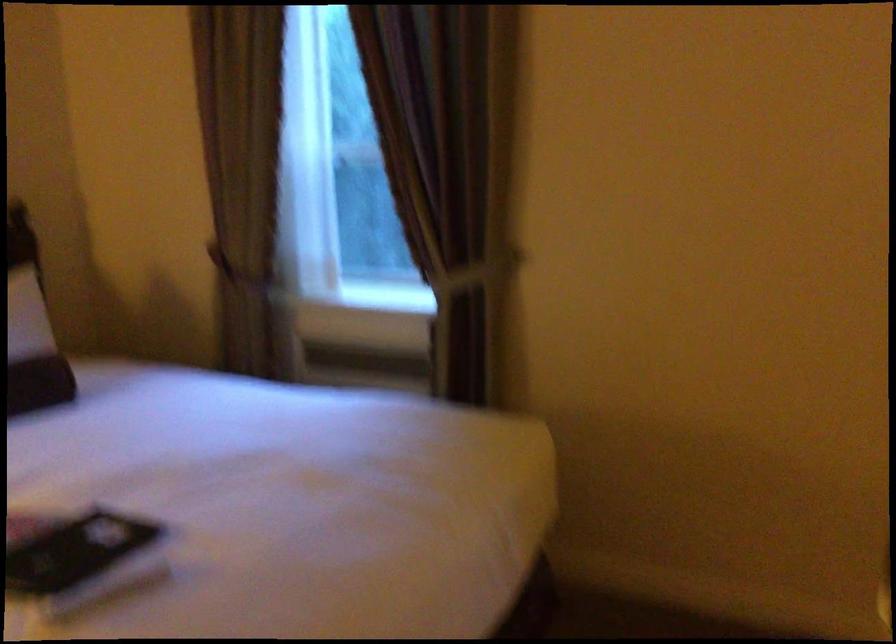
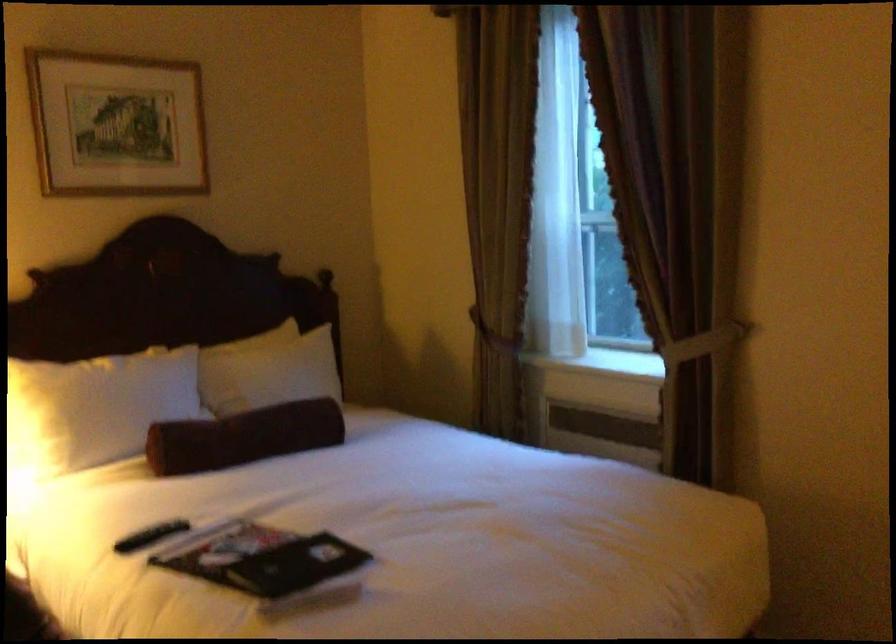
The point at (242,272) is marked in the first image. Where is the corresponding point in the second image?

(494, 334)